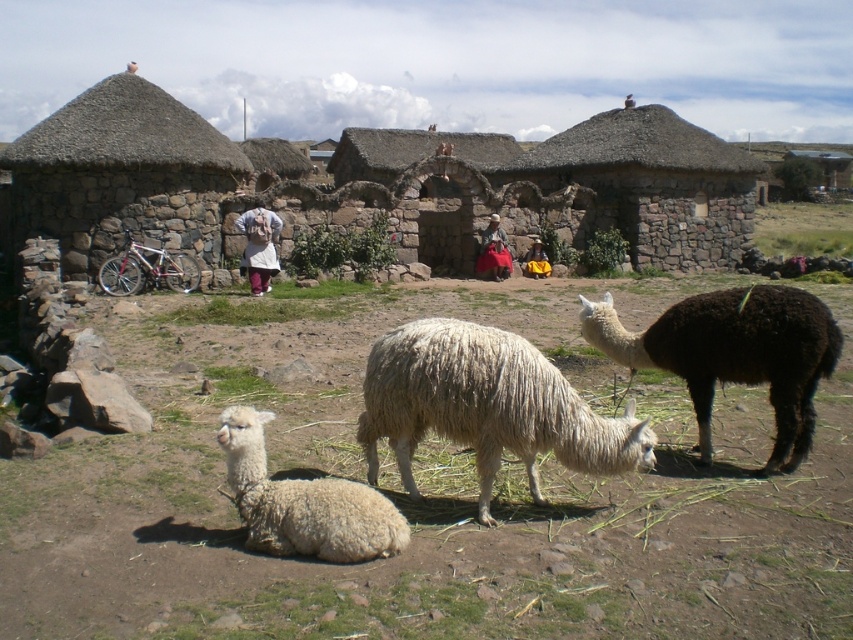
Find the location of a particular element. green soft grass at center is located at coordinates (426, 492).

Can you confirm if green soft grass at center is bigger than white woolen sweater at center?

Correct, green soft grass at center is larger in size than white woolen sweater at center.

Find the location of a particular element. Image resolution: width=853 pixels, height=640 pixels. green soft grass at center is located at coordinates (426, 492).

Is point (547, 477) behind point (343, 547)?

Yes, point (547, 477) is farther from viewer.

Who is taller, green soft grass at center or white woolen sheep at lower left?

green soft grass at center

I want to click on green soft grass at center, so click(x=426, y=492).

Can you confirm if green soft grass at right is thinner than red woven skirt at center?

In fact, green soft grass at right might be wider than red woven skirt at center.

The height and width of the screenshot is (640, 853). What are the coordinates of `green soft grass at right` in the screenshot? It's located at (804, 228).

Is point (779, 212) closer to camera compared to point (482, 256)?

No, (779, 212) is behind (482, 256).

Locate an element on the screen. The width and height of the screenshot is (853, 640). green soft grass at right is located at coordinates (804, 228).